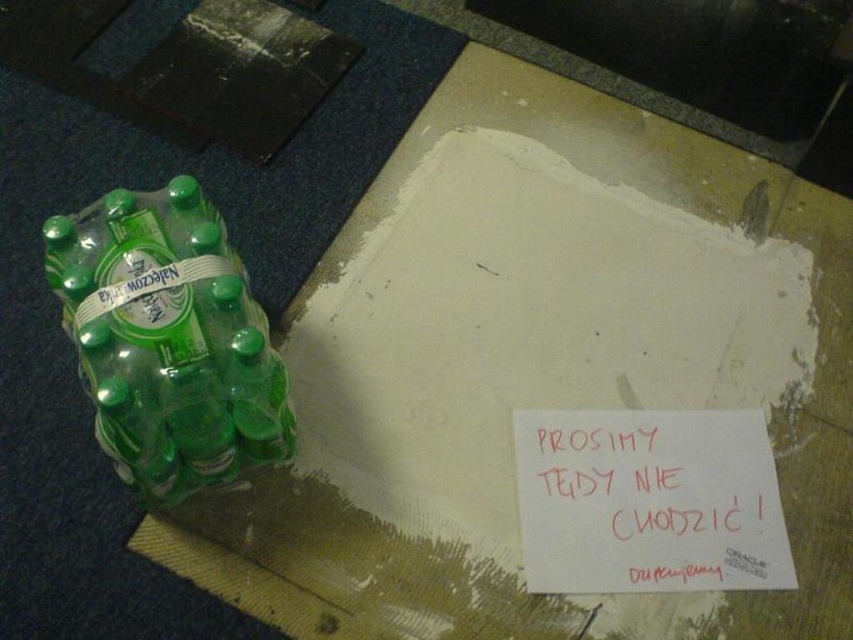
Question: Based on their relative distances, which object is farther from the green plastic bottle at left?

Choices:
 (A) red paper sign at center
 (B) green matte plastic bottles at left

Answer: (A)

Question: Which of these objects is positioned closest to the green matte plastic bottles at left?

Choices:
 (A) red paper sign at center
 (B) green plastic bottle at left

Answer: (B)

Question: Is red paper sign at center below green plastic bottle at left?

Choices:
 (A) yes
 (B) no

Answer: (A)

Question: Can you confirm if green matte plastic bottles at left is smaller than green plastic bottle at left?

Choices:
 (A) no
 (B) yes

Answer: (A)

Question: Which point is farther to the camera?

Choices:
 (A) (97, 260)
 (B) (259, 340)

Answer: (A)

Question: Is green matte plastic bottles at left further to the viewer compared to green plastic bottle at left?

Choices:
 (A) no
 (B) yes

Answer: (A)